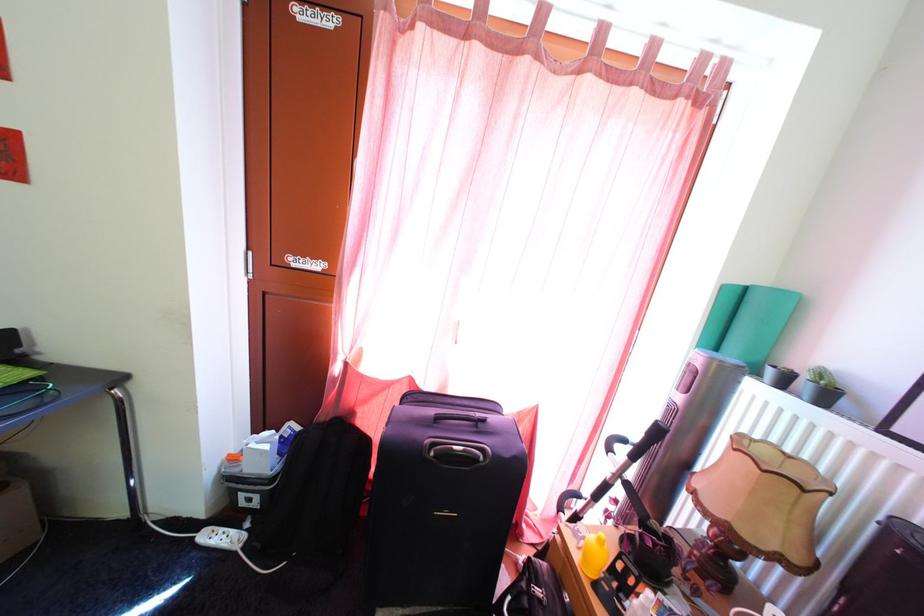
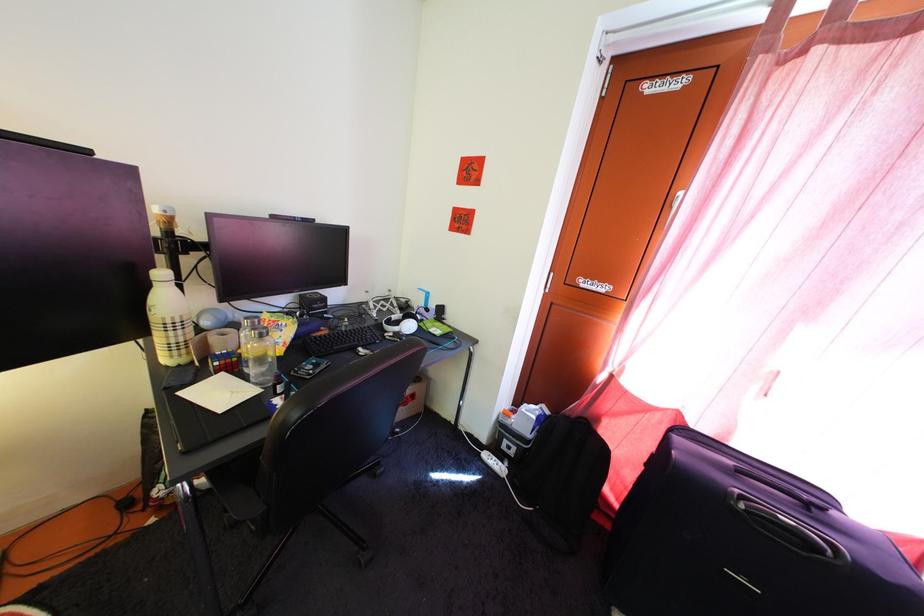
Where in the second image is the point corresponding to point (208, 533) from the first image?

(492, 456)